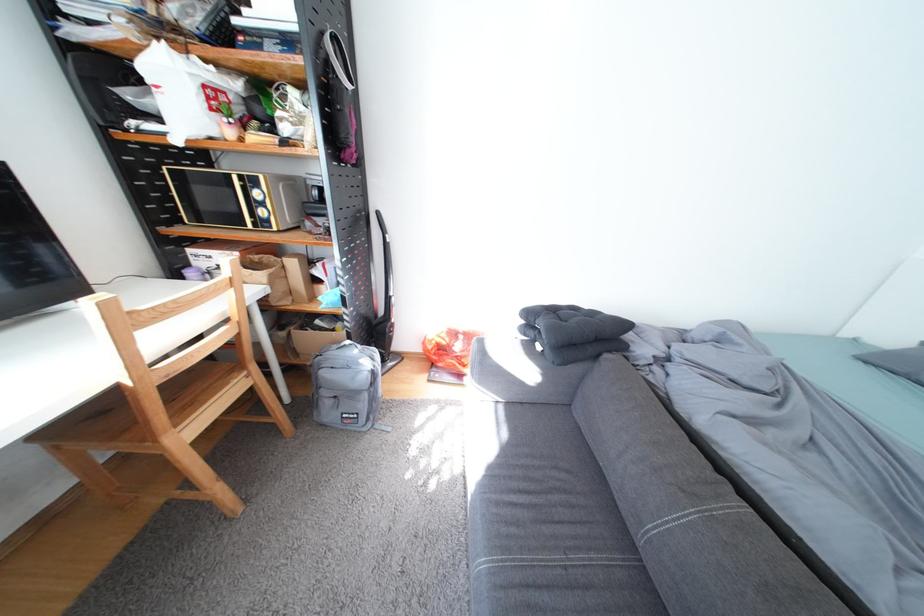
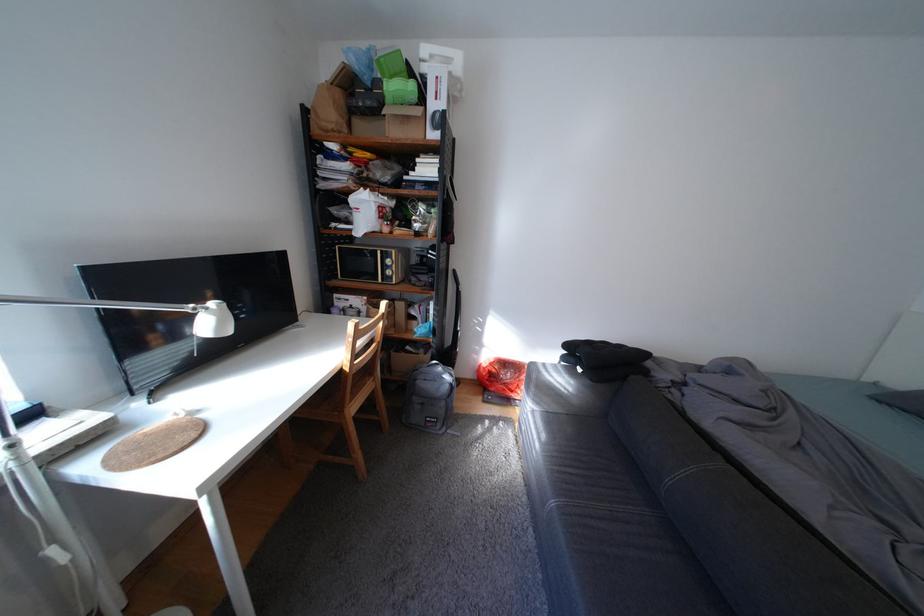
Find the pixel in the second image that matches (x=248, y=179) in the first image.

(392, 253)